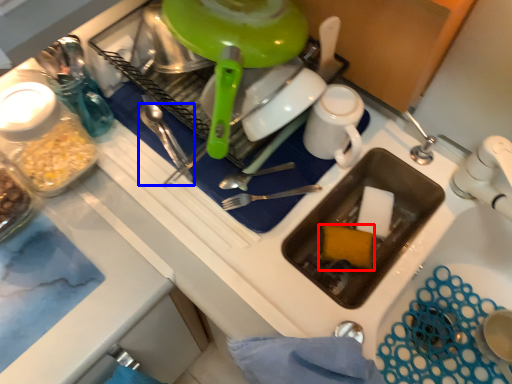
Question: Which point is closer to the camera, food (highlighted by a red box) or silverware (highlighted by a blue box)?

Choices:
 (A) food
 (B) silverware

Answer: (B)